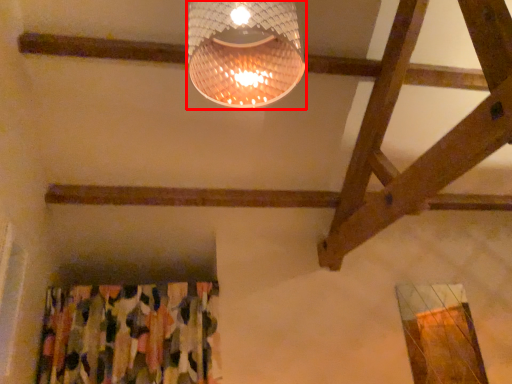
Question: Considering the relative positions of lamp (annotated by the red box) and curtain in the image provided, where is lamp (annotated by the red box) located with respect to the staircase?

Choices:
 (A) left
 (B) right

Answer: (B)